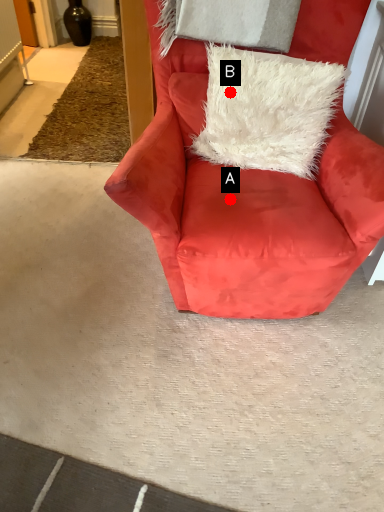
Question: Two points are circled on the image, labeled by A and B beside each circle. Among these points, which one is farthest from the camera?

Choices:
 (A) A is further
 (B) B is further

Answer: (B)